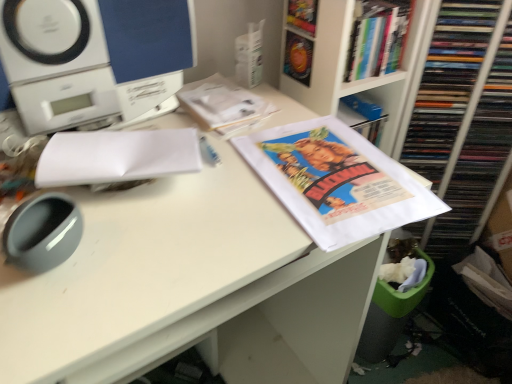
Describe the element at coordinates (377, 37) in the screenshot. I see `hardcover book at upper right, the first book viewed from the right` at that location.

Locate an element on the screen. The image size is (512, 384). hardcover book at upper right, the 2th book positioned from the bottom is located at coordinates (377, 37).

What is the approximate height of white paper at upper center, marked as the second book in a top-to-bottom arrangement?

2.48 centimeters.

What are the coordinates of `white glossy bookcase at upper right` in the screenshot? It's located at (457, 112).

I want to click on white plastic speaker at upper left, so (92, 60).

The image size is (512, 384). What do you see at coordinates (187, 286) in the screenshot?
I see `white paper at center` at bounding box center [187, 286].

The image size is (512, 384). I want to click on white paper at center, so click(187, 286).

What is the approximate height of white paper at left?

white paper at left is 1.14 inches tall.

Locate an element on the screen. This screenshot has height=384, width=512. hardcover book at upper right, the 2th book positioned from the bottom is located at coordinates pos(377,37).

Considering the sizes of objects white paper at center and matte paper poster at center in the image provided, who is taller, white paper at center or matte paper poster at center?

With more height is white paper at center.

From the image's perspective, relative to matte paper poster at center, is white paper at center above or below?

white paper at center is situated lower than matte paper poster at center in the image.

Where is `album that appears on the right of white paper at center`? Image resolution: width=512 pixels, height=384 pixels. album that appears on the right of white paper at center is located at coordinates (336, 181).

How far apart are white paper at center and matte paper poster at center?

white paper at center and matte paper poster at center are 7.95 inches apart.

Considering their positions, is white paper at left located in front of or behind white paper at upper center, which appears as the first book when ordered from the bottom?

Clearly, white paper at left is in front of white paper at upper center, which appears as the first book when ordered from the bottom.

Is white paper at left turned away from white paper at upper center, marked as the 2th book in a right-to-left arrangement?

Absolutely, white paper at left is directed away from white paper at upper center, marked as the 2th book in a right-to-left arrangement.

Which of these two, white paper at left or white paper at upper center, the first book when ordered from left to right, is thinner?

With smaller width is white paper at left.

Visually, is white paper at left positioned to the left or to the right of white paper at upper center, marked as the second book in a top-to-bottom arrangement?

Based on their positions, white paper at left is located to the left of white paper at upper center, marked as the second book in a top-to-bottom arrangement.

Measure the distance from white paper at left to hardcover book at upper right, the first book viewed from the right.

white paper at left is 19.68 inches away from hardcover book at upper right, the first book viewed from the right.

Is white paper at left beside hardcover book at upper right, the first book viewed from the right?

No, white paper at left is not making contact with hardcover book at upper right, the first book viewed from the right.

Is white paper at left positioned beyond the bounds of hardcover book at upper right, the first book viewed from the right?

Yes.

Which object is further away from the camera, white paper at left or hardcover book at upper right, the first book viewed from the right?

Positioned behind is hardcover book at upper right, the first book viewed from the right.

I want to click on bookcase on the left of hardcover book at upper right, which is the first book in top-to-bottom order, so click(x=457, y=112).

From a real-world perspective, is hardcover book at upper right, which is the second book in left-to-right order, beneath white glossy bookcase at upper right?

No.

Which of these two, hardcover book at upper right, which is the second book in left-to-right order, or white glossy bookcase at upper right, stands taller?

Standing taller between the two is white glossy bookcase at upper right.

Considering the sizes of objects hardcover book at upper right, the first book viewed from the right, and white glossy bookcase at upper right in the image provided, who is bigger, hardcover book at upper right, the first book viewed from the right, or white glossy bookcase at upper right?

white glossy bookcase at upper right.

From the image's perspective, is matte paper poster at center above or below white paper at center?

matte paper poster at center is situated higher than white paper at center in the image.

Which of these two, matte paper poster at center or white paper at center, is smaller?

matte paper poster at center is smaller.

Is matte paper poster at center outside of white paper at center?

Actually, matte paper poster at center is at least partially inside white paper at center.

From a real-world perspective, is white paper at upper center, marked as the second book in a top-to-bottom arrangement, beneath white paper at center?

Actually, white paper at upper center, marked as the second book in a top-to-bottom arrangement, is physically above white paper at center in the real world.

Is white paper at upper center, marked as the second book in a top-to-bottom arrangement, at the left side of white paper at center?

Incorrect, white paper at upper center, marked as the second book in a top-to-bottom arrangement, is not on the left side of white paper at center.

Is white paper at upper center, marked as the second book in a top-to-bottom arrangement, in front of or behind white paper at center in the image?

white paper at upper center, marked as the second book in a top-to-bottom arrangement, is behind white paper at center.

Could you tell me if white paper at upper center, marked as the second book in a top-to-bottom arrangement, is facing white paper at center?

No, white paper at upper center, marked as the second book in a top-to-bottom arrangement, is not turned towards white paper at center.

From a real-world perspective, which object stands above the other?

white paper at left, from a real-world perspective.

How far apart are white paper at center and white paper at left?

11.42 inches.

Considering the points (148, 262) and (163, 165), which point is behind, point (148, 262) or point (163, 165)?

Point (163, 165)

Is white paper at center bigger than white paper at left?

Yes, white paper at center is bigger than white paper at left.

Locate an element on the screen. This screenshot has height=384, width=512. album located above the white paper at center (from the image's perspective) is located at coordinates (336, 181).

Find the location of a particular element. The image size is (512, 384). paperback book lying in front of the white paper at upper center, marked as the 2th book in a right-to-left arrangement is located at coordinates (117, 156).

Based on their spatial positions, is white paper at upper center, marked as the 2th book in a right-to-left arrangement, or white paper at center closer to white paper at left?

white paper at upper center, marked as the 2th book in a right-to-left arrangement, is positioned closer to the anchor white paper at left.

From the image, which object appears to be farther from white glossy bookcase at upper right, matte paper poster at center or white paper at left?

white paper at left.

Looking at the image, which one is located further to white paper at center, matte paper poster at center or hardcover book at upper right, the first book viewed from the right?

Based on the image, hardcover book at upper right, the first book viewed from the right, appears to be further to white paper at center.

When comparing their distances from matte paper poster at center, does white paper at upper center, which appears as the first book when ordered from the bottom, or white plastic speaker at upper left seem closer?

Based on the image, white paper at upper center, which appears as the first book when ordered from the bottom, appears to be nearer to matte paper poster at center.

Considering their positions, is white paper at left positioned closer to white glossy bookcase at upper right than white paper at upper center, marked as the 2th book in a right-to-left arrangement?

Among the two, white paper at upper center, marked as the 2th book in a right-to-left arrangement, is located nearer to white glossy bookcase at upper right.

Consider the image. Estimate the real-world distances between objects in this image. Which object is further from white paper at upper center, the first book when ordered from left to right, white paper at left or white plastic speaker at upper left?

The object further to white paper at upper center, the first book when ordered from left to right, is white paper at left.

Looking at the image, which one is located closer to white plastic speaker at upper left, white paper at upper center, marked as the second book in a top-to-bottom arrangement, or matte paper poster at center?

white paper at upper center, marked as the second book in a top-to-bottom arrangement, is closer to white plastic speaker at upper left.

From the image, which object appears to be nearer to matte paper poster at center, white plastic speaker at upper left or white glossy bookcase at upper right?

white plastic speaker at upper left is positioned closer to the anchor matte paper poster at center.

At what (x,y) coordinates should I click in order to perform the action: click on book between white paper at left and matte paper poster at center from left to right. Please return your answer as a coordinate pair (x, y). Looking at the image, I should click on (224, 105).

Image resolution: width=512 pixels, height=384 pixels. Find the location of `album that lies between white glossy bookcase at upper right and white paper at center from top to bottom`. album that lies between white glossy bookcase at upper right and white paper at center from top to bottom is located at coordinates (336, 181).

Where is `book between white glossy bookcase at upper right and white paper at center vertically`? The image size is (512, 384). book between white glossy bookcase at upper right and white paper at center vertically is located at coordinates (224, 105).

This screenshot has height=384, width=512. I want to click on bookcase between hardcover book at upper right, which is the first book in top-to-bottom order, and matte paper poster at center from top to bottom, so click(457, 112).